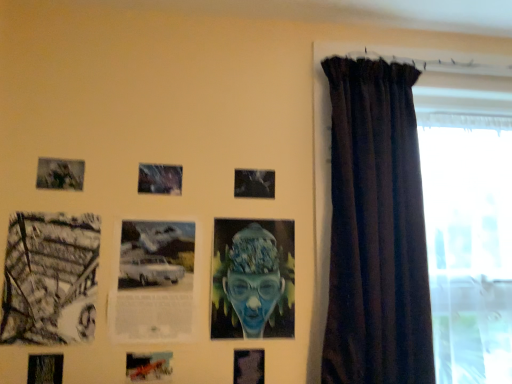
Question: Are metallic silver car at center, positioned as the 4th picture frame in right-to-left order, and transparent glass window at right far apart?

Choices:
 (A) no
 (B) yes

Answer: (B)

Question: Considering the relative sizes of metallic silver car at center, positioned as the 4th picture frame in right-to-left order, and transparent glass window at right in the image provided, is metallic silver car at center, positioned as the 4th picture frame in right-to-left order, wider than transparent glass window at right?

Choices:
 (A) yes
 (B) no

Answer: (B)

Question: Is metallic silver car at center, which is counted as the fifth picture frame, starting from the left, looking in the opposite direction of transparent glass window at right?

Choices:
 (A) no
 (B) yes

Answer: (A)

Question: Does metallic silver car at center, which is counted as the fifth picture frame, starting from the left, lie behind transparent glass window at right?

Choices:
 (A) yes
 (B) no

Answer: (B)

Question: Would you say metallic silver car at center, positioned as the 4th picture frame in right-to-left order, contains transparent glass window at right?

Choices:
 (A) yes
 (B) no

Answer: (B)

Question: Which is correct: matte black picture frame at lower left, which ranks as the 8th picture frame in right-to-left order, is inside metallic silver car at center, positioned as the 4th picture frame in right-to-left order, or outside of it?

Choices:
 (A) inside
 (B) outside

Answer: (B)

Question: From a real-world perspective, is matte black picture frame at lower left, which ranks as the 8th picture frame in right-to-left order, above or below metallic silver car at center, which is counted as the fifth picture frame, starting from the left?

Choices:
 (A) above
 (B) below

Answer: (B)

Question: In terms of size, does matte black picture frame at lower left, the first picture frame when ordered from left to right, appear bigger or smaller than metallic silver car at center, which is counted as the fifth picture frame, starting from the left?

Choices:
 (A) big
 (B) small

Answer: (B)

Question: Is matte black picture frame at lower left, which ranks as the 8th picture frame in right-to-left order, taller or shorter than metallic silver car at center, which is counted as the fifth picture frame, starting from the left?

Choices:
 (A) short
 (B) tall

Answer: (A)

Question: From the image's perspective, is black and white photograph at left, placed as the second picture frame when sorted from left to right, above or below transparent glass window at right?

Choices:
 (A) above
 (B) below

Answer: (B)

Question: Is black and white photograph at left, placed as the second picture frame when sorted from left to right, in front of or behind transparent glass window at right in the image?

Choices:
 (A) front
 (B) behind

Answer: (A)

Question: Based on their sizes in the image, would you say black and white photograph at left, placed as the second picture frame when sorted from left to right, is bigger or smaller than transparent glass window at right?

Choices:
 (A) small
 (B) big

Answer: (A)

Question: Considering the positions of point (83, 283) and point (509, 359), is point (83, 283) closer or farther from the camera than point (509, 359)?

Choices:
 (A) closer
 (B) farther

Answer: (A)

Question: From a real-world perspective, relative to dark velvet curtain at right, is matte black photo frame at upper left, the sixth picture frame positioned from the right, vertically above or below?

Choices:
 (A) below
 (B) above

Answer: (B)

Question: Considering their positions, is matte black photo frame at upper left, acting as the 3th picture frame starting from the left, located in front of or behind dark velvet curtain at right?

Choices:
 (A) front
 (B) behind

Answer: (B)